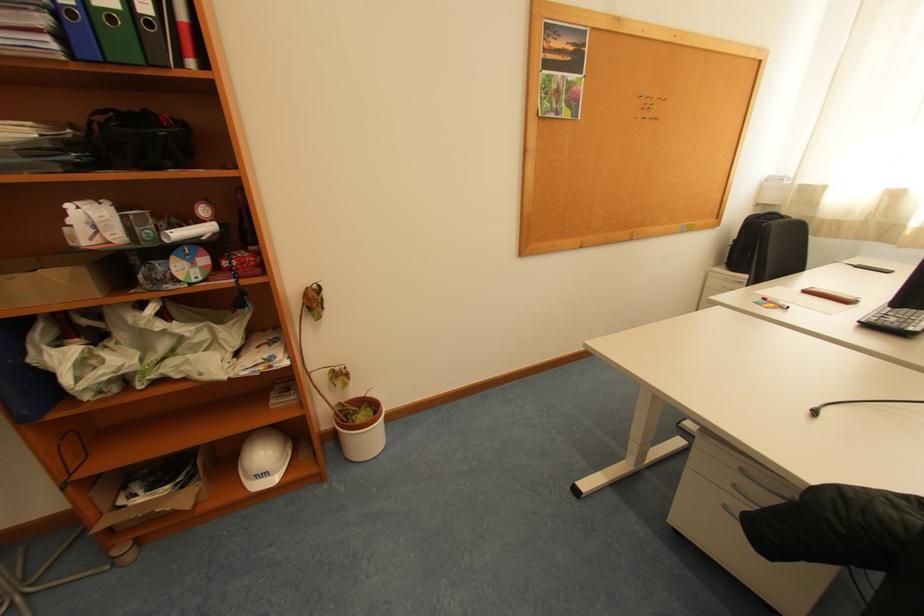
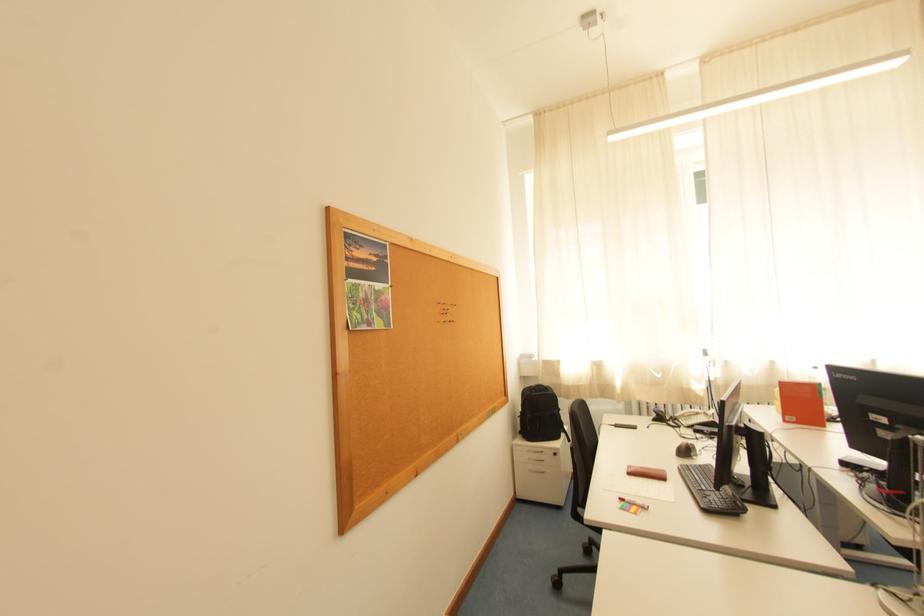
Find the pixel in the second image that matches [870,322] in the first image.

(711, 508)